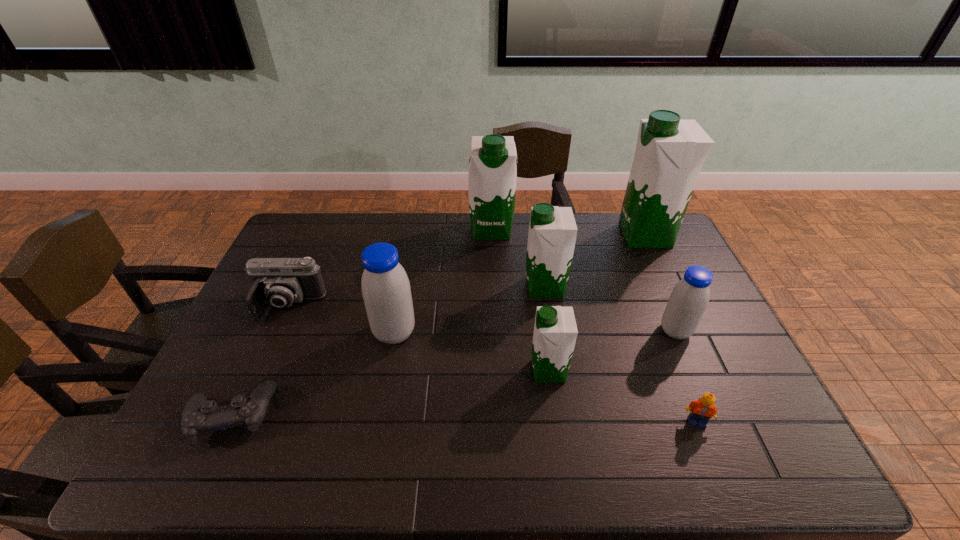
Find the location of a particular element. The height and width of the screenshot is (540, 960). vacant space at the near right corner of the desktop is located at coordinates (725, 457).

The image size is (960, 540). Identify the location of vacant space in between the Lego and the smaller blue soya milk. (685, 376).

Locate an element on the screen. free space between the smallest green soya milk and the gray control is located at coordinates (390, 393).

You are a GUI agent. You are given a task and a screenshot of the screen. Output one action in this format:
    pyautogui.click(x=<x>, y=<y>)
    Task: Click on the free area in between the smaller blue soya milk and the nearest green soya milk
    
    Given the screenshot: What is the action you would take?
    pyautogui.click(x=612, y=351)

I want to click on free spot between the control and the smallest green soya milk, so click(x=390, y=393).

Identify the location of free space between the tallest soya milk and the third farthest soya milk. This screenshot has height=540, width=960. (595, 261).

Locate an element on the screen. This screenshot has height=540, width=960. empty space that is in between the camera and the second nearest green soya milk is located at coordinates click(x=417, y=297).

You are a GUI agent. You are given a task and a screenshot of the screen. Output one action in this format:
    pyautogui.click(x=<x>, y=<y>)
    Task: Click on the vacant region between the seventh object from right to left and the tallest soya milk
    
    Given the screenshot: What is the action you would take?
    pyautogui.click(x=520, y=284)

Where is `empty space that is in between the smaller blue soya milk and the second shortest object`? empty space that is in between the smaller blue soya milk and the second shortest object is located at coordinates (685, 376).

Where is `object that can be found as the second closest to the leftmost soya milk`? The width and height of the screenshot is (960, 540). object that can be found as the second closest to the leftmost soya milk is located at coordinates (199, 416).